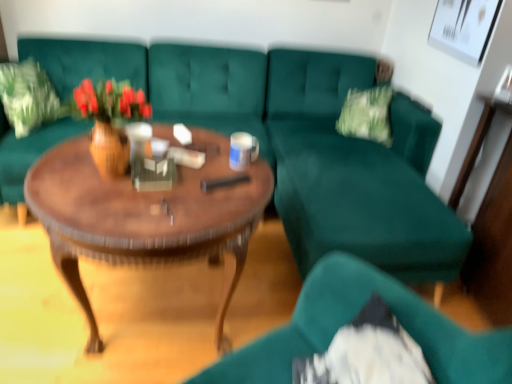
Question: Considering the positions of green fabric pillow at upper left and teal fabric chair at lower right in the image, is green fabric pillow at upper left bigger or smaller than teal fabric chair at lower right?

Choices:
 (A) big
 (B) small

Answer: (B)

Question: From a real-world perspective, is green fabric pillow at upper left physically located above or below teal fabric chair at lower right?

Choices:
 (A) below
 (B) above

Answer: (B)

Question: Which is nearer to the wooden polished coffee table at center?

Choices:
 (A) wooden vase with flowers at center
 (B) teal fabric couch at center
 (C) green fabric pillow at upper left
 (D) teal fabric chair at lower right

Answer: (A)

Question: Considering the real-world distances, which object is closest to the wooden vase with flowers at center?

Choices:
 (A) wooden polished coffee table at center
 (B) green fabric pillow at upper left
 (C) teal fabric couch at center
 (D) teal fabric chair at lower right

Answer: (A)